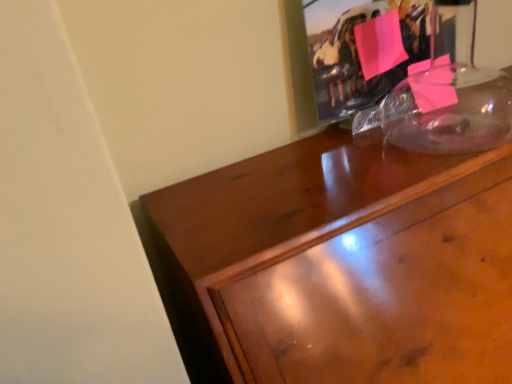
Question: Is pink paper at upper center taller than glossy wood desk at upper right?

Choices:
 (A) yes
 (B) no

Answer: (B)

Question: Is glossy wood desk at upper right located within pink paper at upper center?

Choices:
 (A) yes
 (B) no

Answer: (B)

Question: Is the depth of pink paper at upper center greater than that of glossy wood desk at upper right?

Choices:
 (A) yes
 (B) no

Answer: (A)

Question: Is pink paper at upper center smaller than glossy wood desk at upper right?

Choices:
 (A) no
 (B) yes

Answer: (B)

Question: Is pink paper at upper center with glossy wood desk at upper right?

Choices:
 (A) yes
 (B) no

Answer: (B)

Question: Is pink paper at upper center bigger than glossy wood desk at upper right?

Choices:
 (A) no
 (B) yes

Answer: (A)

Question: Does glossy wood desk at upper right have a larger size compared to pink paper at upper center?

Choices:
 (A) no
 (B) yes

Answer: (B)

Question: Is glossy wood desk at upper right to the right of pink paper at upper center from the viewer's perspective?

Choices:
 (A) yes
 (B) no

Answer: (A)

Question: Is glossy wood desk at upper right behind pink paper at upper center?

Choices:
 (A) no
 (B) yes

Answer: (A)

Question: Is glossy wood desk at upper right turned away from pink paper at upper center?

Choices:
 (A) no
 (B) yes

Answer: (A)

Question: From a real-world perspective, is glossy wood desk at upper right beneath pink paper at upper center?

Choices:
 (A) no
 (B) yes

Answer: (B)

Question: From a real-world perspective, is glossy wood desk at upper right on top of pink paper at upper center?

Choices:
 (A) no
 (B) yes

Answer: (A)

Question: From the image's perspective, is glossy wood desk at upper right above or below pink paper at upper center?

Choices:
 (A) above
 (B) below

Answer: (B)